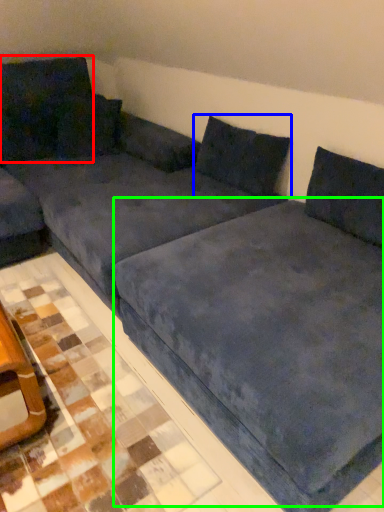
Question: Based on their relative distances, which object is farther from pillow (highlighted by a red box)? Choose from pillow (highlighted by a blue box) and bedding (highlighted by a green box).

Choices:
 (A) pillow
 (B) bedding

Answer: (B)